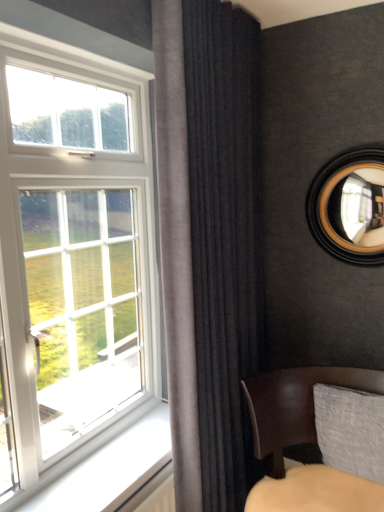
Question: Should I look upward or downward to see dark velvet curtain at center?

Choices:
 (A) up
 (B) down

Answer: (B)

Question: Does dark velvet curtain at center turn towards leather cushion at lower right?

Choices:
 (A) yes
 (B) no

Answer: (A)

Question: Is dark velvet curtain at center looking in the opposite direction of leather cushion at lower right?

Choices:
 (A) yes
 (B) no

Answer: (A)

Question: Considering the relative sizes of dark velvet curtain at center and leather cushion at lower right in the image provided, is dark velvet curtain at center smaller than leather cushion at lower right?

Choices:
 (A) yes
 (B) no

Answer: (A)

Question: From a real-world perspective, is dark velvet curtain at center below leather cushion at lower right?

Choices:
 (A) no
 (B) yes

Answer: (A)

Question: From the image's perspective, is dark velvet curtain at center beneath leather cushion at lower right?

Choices:
 (A) no
 (B) yes

Answer: (A)

Question: Does dark velvet curtain at center have a greater width compared to leather cushion at lower right?

Choices:
 (A) yes
 (B) no

Answer: (B)

Question: Is leather cushion at lower right at the back of wooden-framed mirror at upper right?

Choices:
 (A) no
 (B) yes

Answer: (A)

Question: Can you confirm if wooden-framed mirror at upper right is wider than leather cushion at lower right?

Choices:
 (A) yes
 (B) no

Answer: (B)

Question: Is wooden-framed mirror at upper right positioned beyond the bounds of leather cushion at lower right?

Choices:
 (A) yes
 (B) no

Answer: (A)

Question: Can you see wooden-framed mirror at upper right touching leather cushion at lower right?

Choices:
 (A) yes
 (B) no

Answer: (B)

Question: Considering the relative positions of wooden-framed mirror at upper right and leather cushion at lower right in the image provided, is wooden-framed mirror at upper right to the right of leather cushion at lower right from the viewer's perspective?

Choices:
 (A) no
 (B) yes

Answer: (B)

Question: Is wooden-framed mirror at upper right not close to leather cushion at lower right?

Choices:
 (A) yes
 (B) no

Answer: (B)

Question: Is wooden-framed mirror at upper right smaller than dark velvet curtain at center?

Choices:
 (A) yes
 (B) no

Answer: (A)